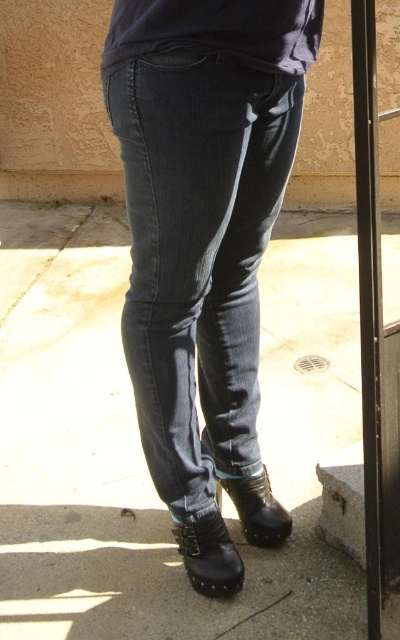
You are a delivery robot that needs to deliver a package to the front door. You see the gray concrete pavement at lower center and the dark blue denim jeans at center. Which object is closer to you?

The gray concrete pavement at lower center is closer to you because the dark blue denim jeans at center is behind it.

You are taking a photo of the person from the camera position. Which point, point (105, 497) or point (233, 326), will appear closer to the camera in the photo?

Point (105, 497) is further to the camera than point (233, 326), so it will appear closer to the camera in the photo.

You are a delivery robot with a 20 cm wide package. You need to place the package between the gray concrete pavement at lower center and the dark blue denim jeans at center. Is there enough space for the package?

The gray concrete pavement at lower center is wider than the dark blue denim jeans at center. Therefore, the space between them is sufficient to accommodate a 20 cm wide package.